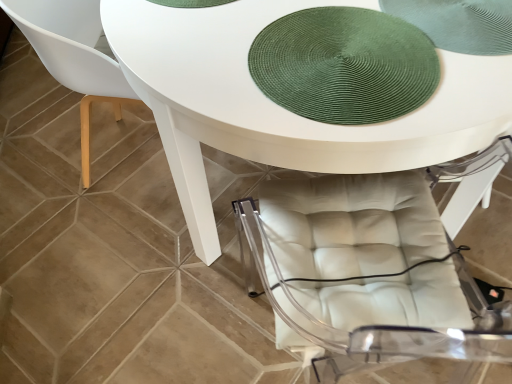
Question: From the image's perspective, relative to green woven mat at upper center, is white glossy table at center above or below?

Choices:
 (A) below
 (B) above

Answer: (B)

Question: Choose the correct answer: Is white glossy table at center inside green woven mat at upper center or outside it?

Choices:
 (A) outside
 (B) inside

Answer: (A)

Question: Estimate the real-world distances between objects in this image. Which object is closer to the white glossy table at center?

Choices:
 (A) green woven mat at upper center
 (B) matte white chair at lower left

Answer: (A)

Question: Considering the real-world distances, which object is closest to the white glossy table at center?

Choices:
 (A) green woven mat at upper center
 (B) matte white chair at lower left

Answer: (A)